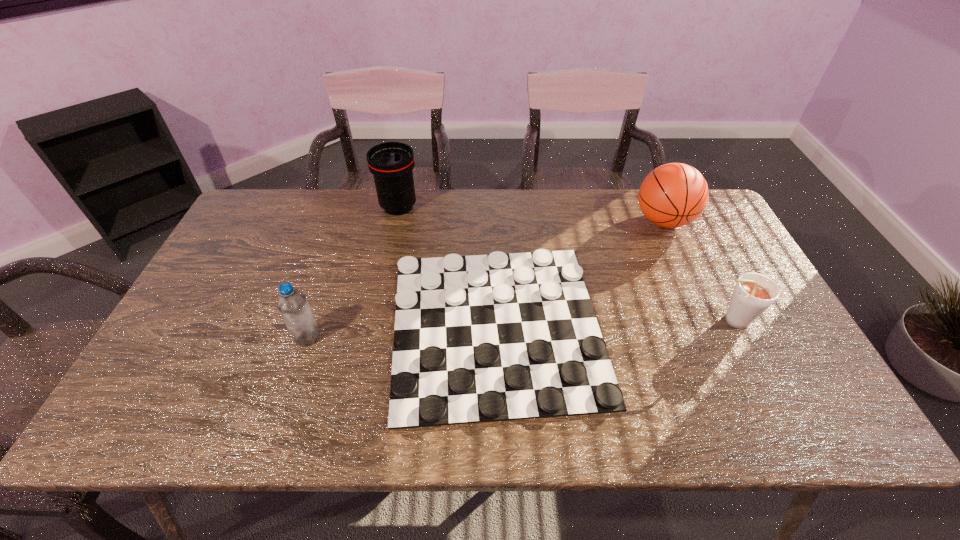
Image resolution: width=960 pixels, height=540 pixels. I want to click on vacant space located on the drink side of the root beer, so click(x=650, y=320).

I want to click on vacant position located 0.240m on the right of the gameboard, so click(x=699, y=326).

Identify the location of telephoto lens positioned at the far edge. The image size is (960, 540). (391, 163).

Where is `basketball located at the far edge`? The image size is (960, 540). basketball located at the far edge is located at coordinates (673, 195).

Find the location of a particular element. Image resolution: width=960 pixels, height=540 pixels. object that is at the near edge is located at coordinates (484, 338).

This screenshot has height=540, width=960. What are the coordinates of `basketball that is positioned at the right edge` in the screenshot? It's located at (673, 195).

This screenshot has width=960, height=540. I want to click on root beer at the right edge, so click(x=754, y=293).

This screenshot has width=960, height=540. Find the location of `object situated at the far right corner`. object situated at the far right corner is located at coordinates (673, 195).

In the image, there is a desktop. At what (x,y) coordinates should I click in order to perform the action: click on vacant space at the far edge. Please return your answer as a coordinate pair (x, y). The image size is (960, 540). Looking at the image, I should click on (534, 226).

Identify the location of blank space at the near edge. (302, 428).